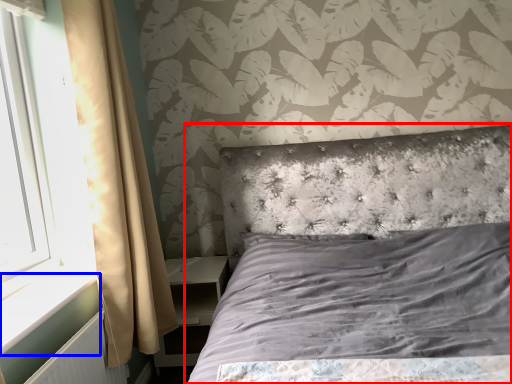
Question: Which point is closer to the camera, bed (highlighted by a red box) or window sill (highlighted by a blue box)?

Choices:
 (A) bed
 (B) window sill

Answer: (A)